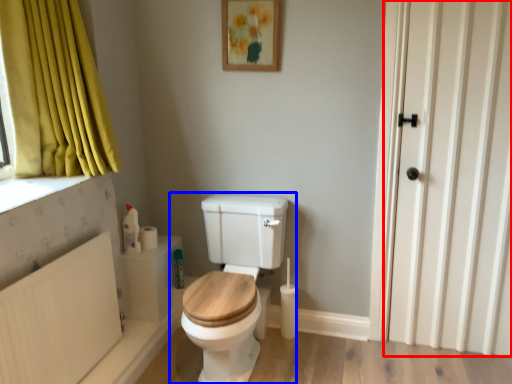
Question: Among these objects, which one is farthest to the camera, door (highlighted by a red box) or toilet (highlighted by a blue box)?

Choices:
 (A) door
 (B) toilet

Answer: (A)